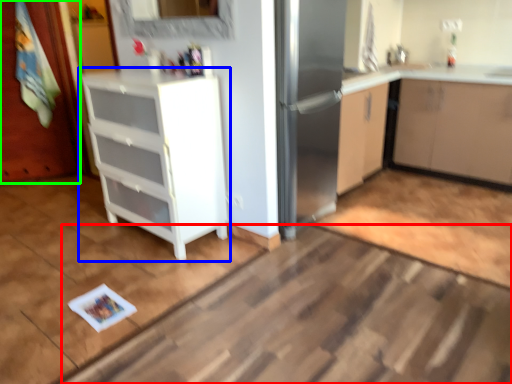
Question: Based on their relative distances, which object is farther from plain (highlighted by a red box)? Choose from cabinetry (highlighted by a blue box) and door (highlighted by a green box).

Choices:
 (A) cabinetry
 (B) door

Answer: (B)